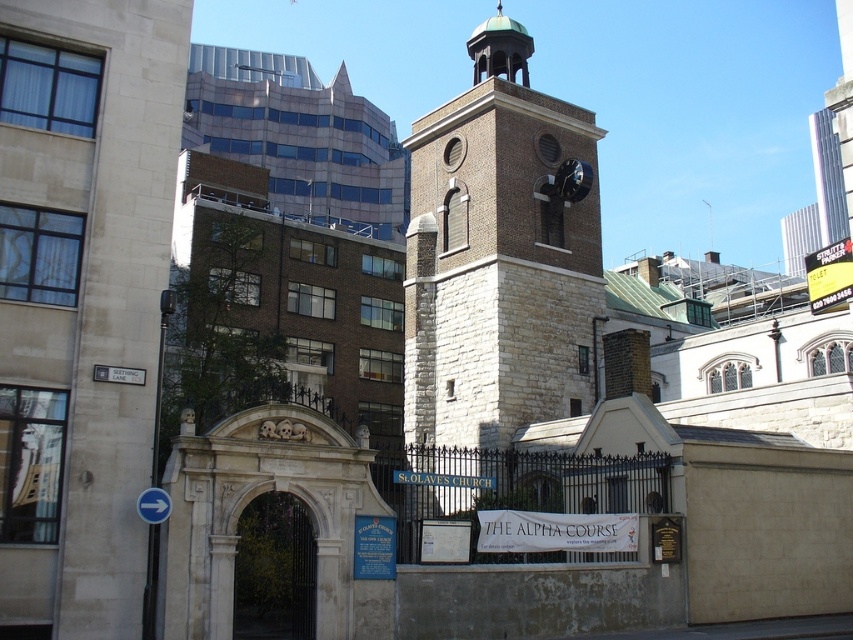
Question: Which point is farther to the camera?

Choices:
 (A) polished brass clock at upper center
 (B) stone clock tower at center

Answer: (A)

Question: Does stone clock tower at center have a greater width compared to green copper bell tower at center?

Choices:
 (A) yes
 (B) no

Answer: (A)

Question: Is stone clock tower at center positioned in front of polished brass clock at upper center?

Choices:
 (A) yes
 (B) no

Answer: (A)

Question: Which point is closer to the camera?

Choices:
 (A) (563, 196)
 (B) (485, 186)
 (C) (502, 64)

Answer: (B)

Question: Does stone clock tower at center have a lesser width compared to polished brass clock at upper center?

Choices:
 (A) yes
 (B) no

Answer: (B)

Question: Considering the real-world distances, which object is farthest from the polished brass clock at upper center?

Choices:
 (A) green copper bell tower at center
 (B) stone clock tower at center

Answer: (A)